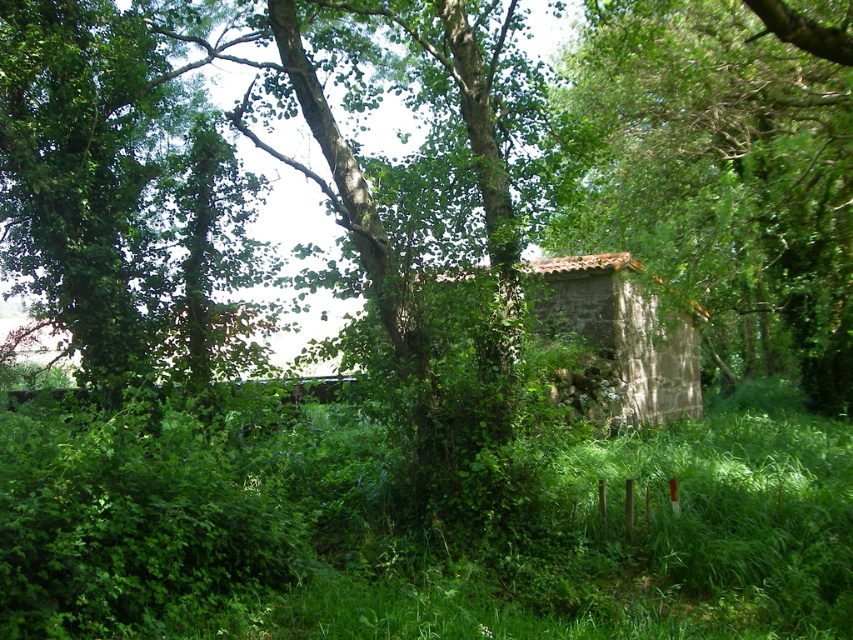
Question: Does green leafy grass at center appear under stone textured hut at center?

Choices:
 (A) no
 (B) yes

Answer: (B)

Question: Considering the real-world distances, which object is closest to the green leafy tree at center?

Choices:
 (A) green leafy grass at center
 (B) stone textured hut at center

Answer: (A)

Question: In this image, where is green leafy grass at center located relative to green leafy tree at center?

Choices:
 (A) right
 (B) left

Answer: (B)

Question: Does green leafy grass at center have a greater width compared to stone textured hut at center?

Choices:
 (A) yes
 (B) no

Answer: (A)

Question: Among these objects, which one is nearest to the camera?

Choices:
 (A) green leafy tree at center
 (B) stone textured hut at center
 (C) green leafy grass at center

Answer: (C)

Question: Which point appears closest to the camera in this image?

Choices:
 (A) (582, 330)
 (B) (837, 611)
 (C) (815, 216)

Answer: (B)